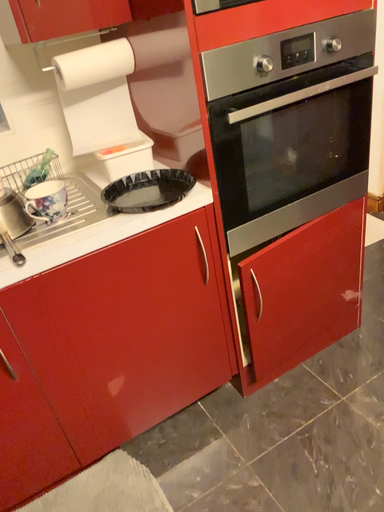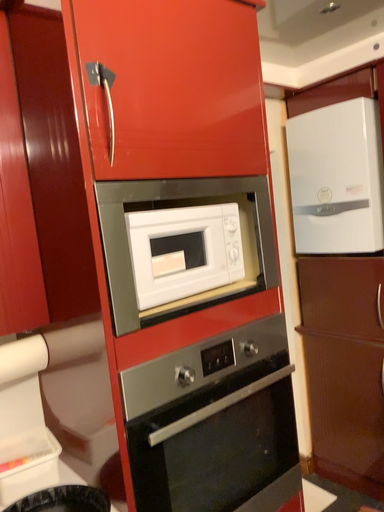
Question: Which way did the camera rotate in the video?

Choices:
 (A) rotated left
 (B) rotated right

Answer: (B)